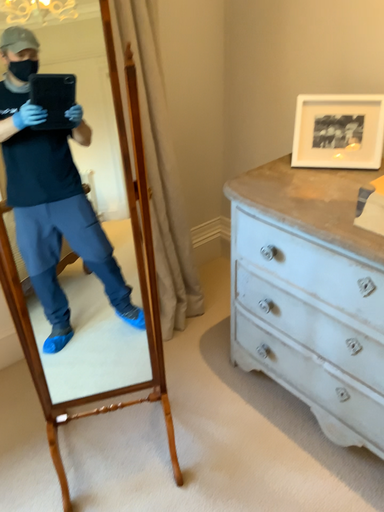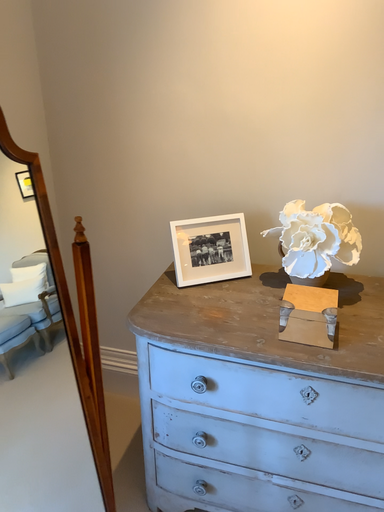
Question: How did the camera likely rotate when shooting the video?

Choices:
 (A) rotated left
 (B) rotated right

Answer: (B)